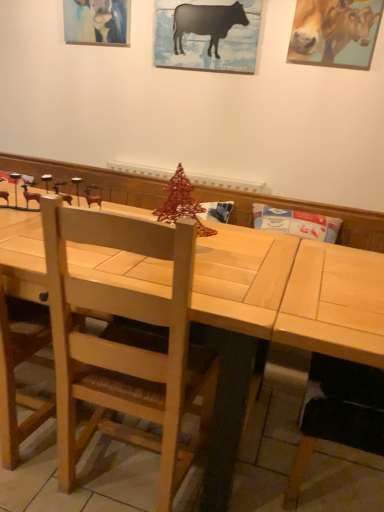
Question: Should I look upward or downward to see matte acrylic painting at upper left?

Choices:
 (A) down
 (B) up

Answer: (B)

Question: Is the position of black matte/ceramic cow at upper center, the second cattle when ordered from right to left, less distant than that of golden glossy cow at upper right, the second cattle positioned from the left?

Choices:
 (A) yes
 (B) no

Answer: (B)

Question: Is black matte/ceramic cow at upper center, the second cattle when ordered from right to left, outside of golden glossy cow at upper right, which is the 1th cattle from right to left?

Choices:
 (A) yes
 (B) no

Answer: (A)

Question: Is black matte/ceramic cow at upper center, which ranks as the 1th cattle in left-to-right order, further to camera compared to golden glossy cow at upper right, the second cattle positioned from the left?

Choices:
 (A) no
 (B) yes

Answer: (B)

Question: Is black matte/ceramic cow at upper center, the second cattle when ordered from right to left, thinner than golden glossy cow at upper right, which is the 1th cattle from right to left?

Choices:
 (A) yes
 (B) no

Answer: (A)

Question: Is black matte/ceramic cow at upper center, the second cattle when ordered from right to left, touching golden glossy cow at upper right, the second cattle positioned from the left?

Choices:
 (A) no
 (B) yes

Answer: (A)

Question: Is golden glossy cow at upper right, which is the 1th cattle from right to left, surrounded by black matte/ceramic cow at upper center, which ranks as the 1th cattle in left-to-right order?

Choices:
 (A) yes
 (B) no

Answer: (B)

Question: Is light brown wooden chair at center not within golden glossy cow at upper right, the second cattle positioned from the left?

Choices:
 (A) yes
 (B) no

Answer: (A)

Question: Can you confirm if light brown wooden chair at center is positioned to the left of golden glossy cow at upper right, which is the 1th cattle from right to left?

Choices:
 (A) no
 (B) yes

Answer: (B)

Question: From the image's perspective, is light brown wooden chair at center on golden glossy cow at upper right, the second cattle positioned from the left?

Choices:
 (A) no
 (B) yes

Answer: (A)

Question: Is light brown wooden chair at center shorter than golden glossy cow at upper right, the second cattle positioned from the left?

Choices:
 (A) no
 (B) yes

Answer: (A)

Question: Considering the relative sizes of light brown wooden chair at center and golden glossy cow at upper right, which is the 1th cattle from right to left, in the image provided, is light brown wooden chair at center smaller than golden glossy cow at upper right, which is the 1th cattle from right to left,?

Choices:
 (A) yes
 (B) no

Answer: (B)

Question: Considering the relative sizes of light brown wooden chair at center and golden glossy cow at upper right, which is the 1th cattle from right to left, in the image provided, is light brown wooden chair at center wider than golden glossy cow at upper right, which is the 1th cattle from right to left,?

Choices:
 (A) no
 (B) yes

Answer: (B)

Question: From a real-world perspective, is golden glossy cow at upper right, the second cattle positioned from the left, on top of matte acrylic painting at upper left?

Choices:
 (A) yes
 (B) no

Answer: (A)